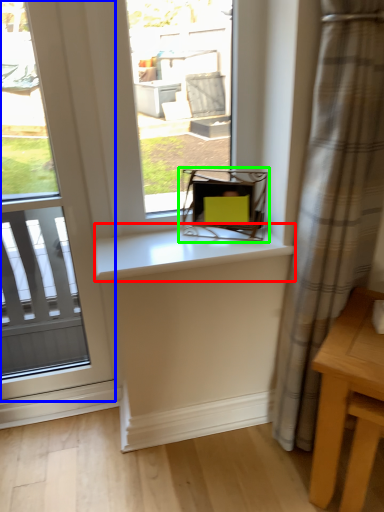
Question: Considering the real-world distances, which object is farthest from counter top (highlighted by a red box)? window (highlighted by a blue box) or chair (highlighted by a green box)?

Choices:
 (A) window
 (B) chair

Answer: (A)